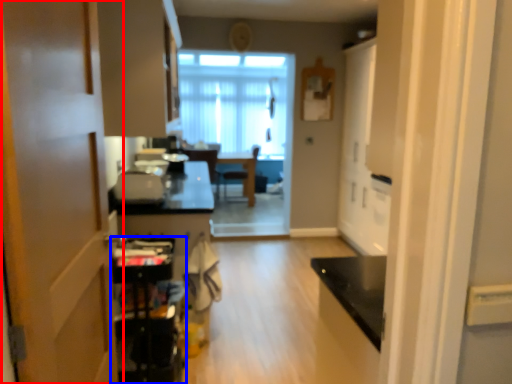
Question: Which object appears closest to the camera in this image, door (highlighted by a red box) or appliance (highlighted by a blue box)?

Choices:
 (A) door
 (B) appliance

Answer: (A)